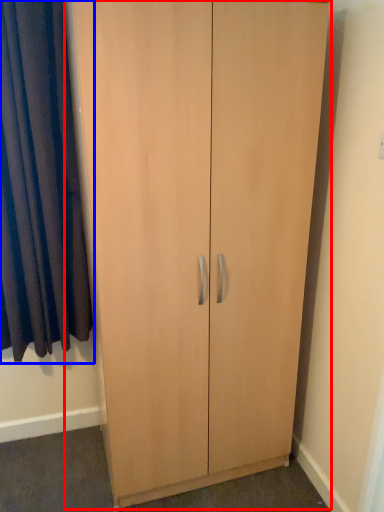
Question: Which point is closer to the camera, cupboard (highlighted by a red box) or curtain (highlighted by a blue box)?

Choices:
 (A) cupboard
 (B) curtain

Answer: (A)